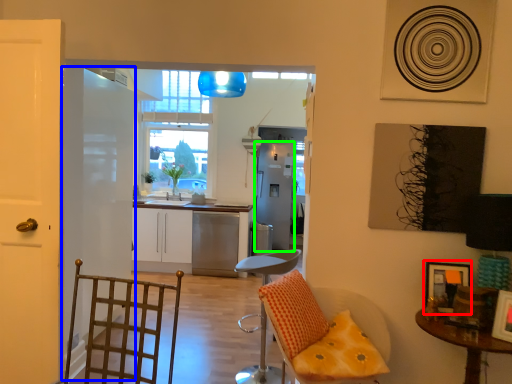
Question: Which is nearer to the picture frame (highlighted by a red box)? door (highlighted by a blue box) or appliance (highlighted by a green box).

Choices:
 (A) door
 (B) appliance

Answer: (A)